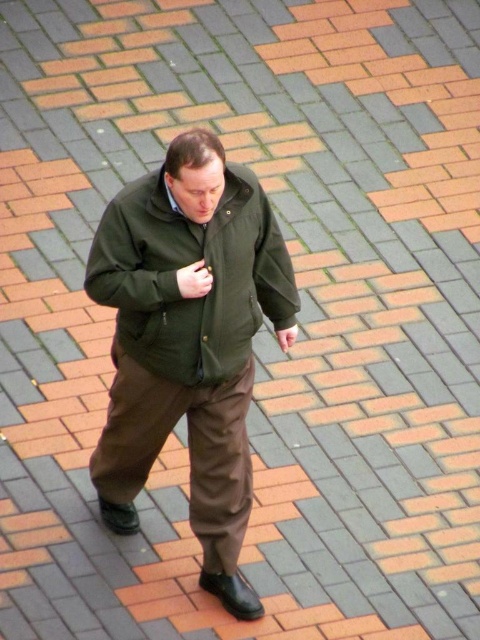
From the picture: You are a fashion designer observing the man in the scene. You need to determine which piece of clothing is shorter between the olive green fabric jacket at center and the matte khaki pants at center. Which one is shorter?

The olive green fabric jacket at center is shorter than the matte khaki pants at center.

You are a fashion designer observing a man wearing a green matte jacket at center and matte khaki pants at center. You need to design a belt that fits between them. What is the minimum length required for the belt to comfortably fit between the jacket and pants?

The green matte jacket at center and matte khaki pants at center are 9.02 inches apart from each other. Therefore, the minimum length required for the belt to comfortably fit between them should be at least 9.02 inches.